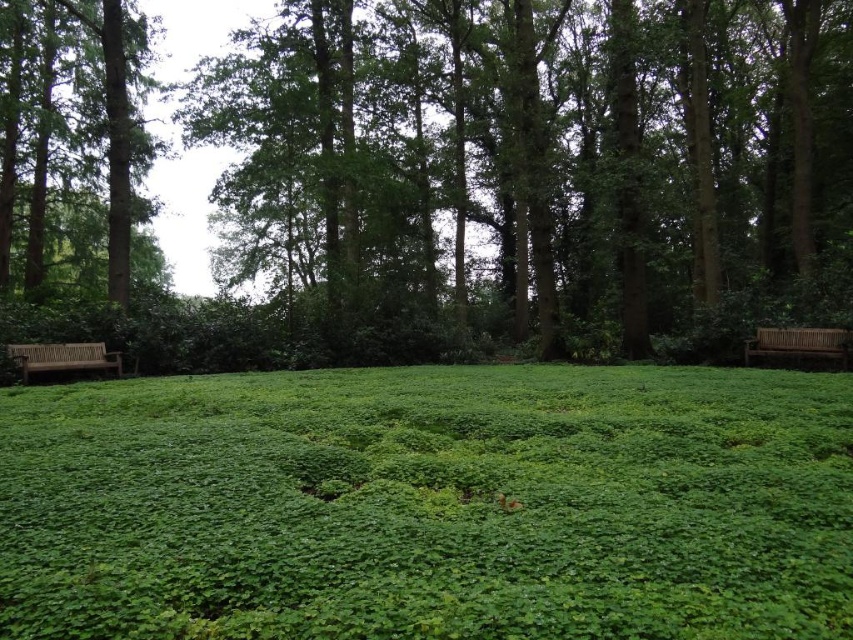
Question: Which point is farther to the camera?

Choices:
 (A) green textured tree at left
 (B) wooden bench at right
 (C) green leafy tree at center
 (D) green leafy grass at center

Answer: (A)

Question: Is green leafy tree at center to the left of green leafy grass at center from the viewer's perspective?

Choices:
 (A) no
 (B) yes

Answer: (B)

Question: Which object is the closest to the wooden bench at left?

Choices:
 (A) green leafy grass at center
 (B) wooden bench at right
 (C) green textured tree at left

Answer: (C)

Question: Considering the relative positions of green textured tree at left and wooden bench at right in the image provided, where is green textured tree at left located with respect to wooden bench at right?

Choices:
 (A) below
 (B) above

Answer: (B)

Question: Does green leafy tree at center appear over wooden bench at left?

Choices:
 (A) no
 (B) yes

Answer: (B)

Question: Which of the following is the closest to the observer?

Choices:
 (A) green leafy tree at center
 (B) wooden bench at right

Answer: (B)